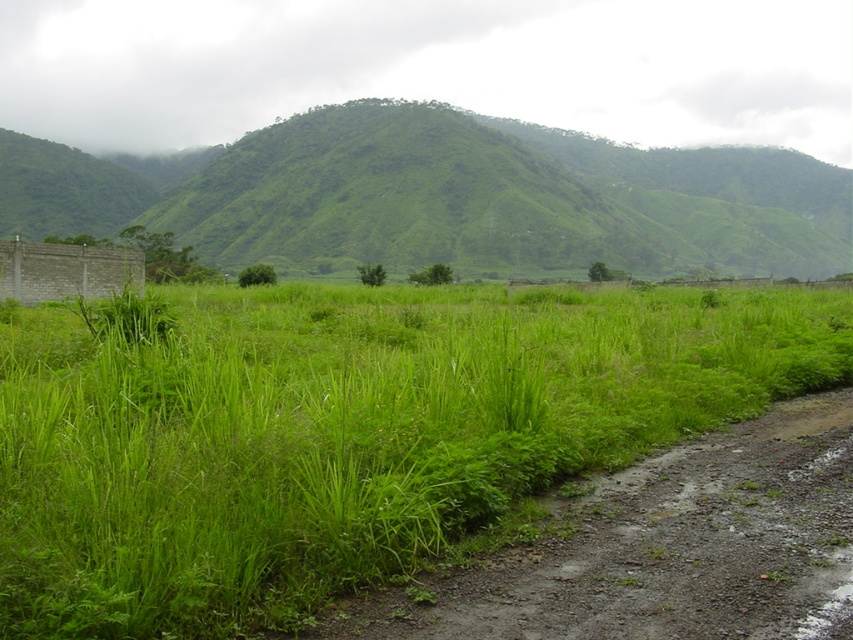
You are a hiker trying to navigate through this landscape. You need to cross either the green grassy hill at left or the damp gravel path at lower right. Which option has a wider path for you to walk on?

The green grassy hill at left has a wider path than the damp gravel path at lower right because the green grassy hill at left is wider.

You are navigating a drone that requires a flat area to land. You observe the green grassy hill at left in the image. Based on its position, can you determine if it offers a suitable landing spot?

The green grassy hill at left is located at point coordinates that may not provide a flat surface for landing. However, the description does not specify the hilltop terrain, so it is uncertain if it is flat enough for the drone to land safely.

You are a hiker trying to find the shortest path to the damp gravel path at lower right from your current position near the green grassy field at center. Which direction should you head towards?

The green grassy field at center is closer to the viewer than damp gravel path at lower right, so you should head towards the lower right direction to reach the damp gravel path at lower right more quickly.